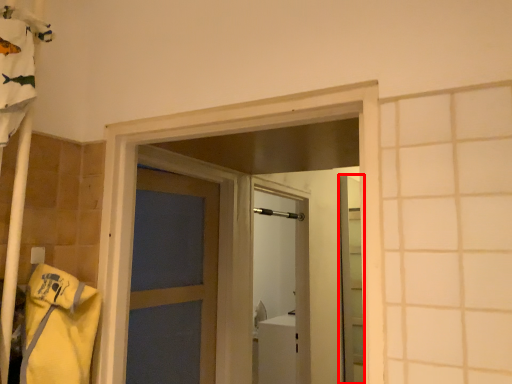
Question: From the image's perspective, where is elevator (annotated by the red box) located in relation to shower in the image?

Choices:
 (A) below
 (B) above

Answer: (A)